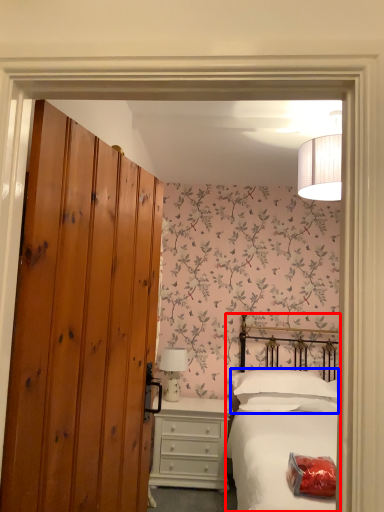
Question: Which object appears closest to the camera in this image, bed (highlighted by a red box) or pillow (highlighted by a blue box)?

Choices:
 (A) bed
 (B) pillow

Answer: (A)